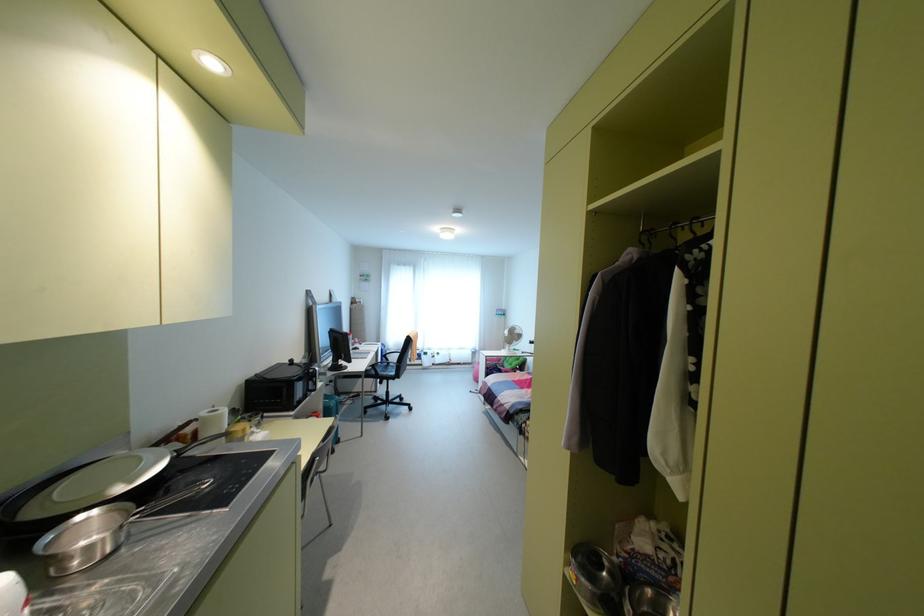
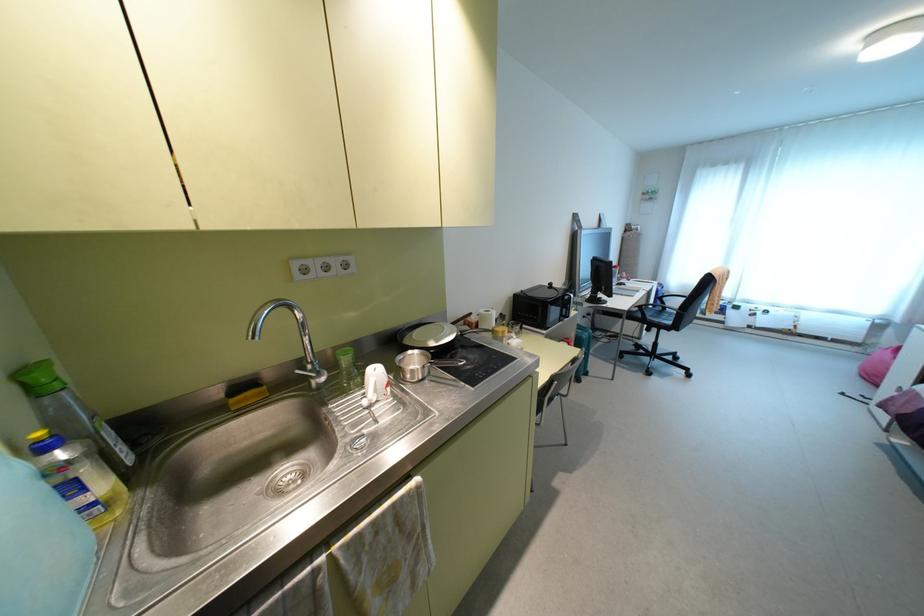
The point at (x=393, y=358) is marked in the first image. Where is the corresponding point in the second image?

(674, 302)